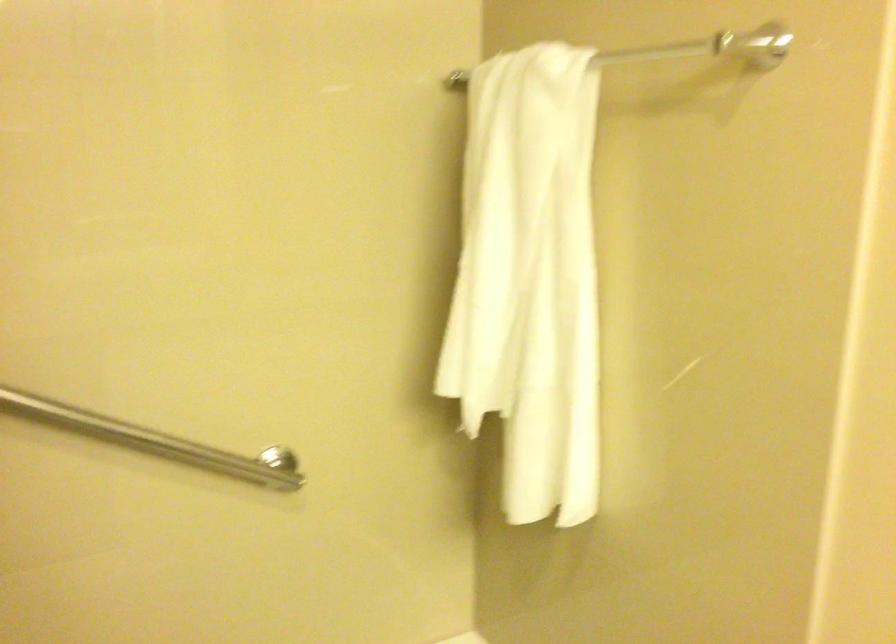
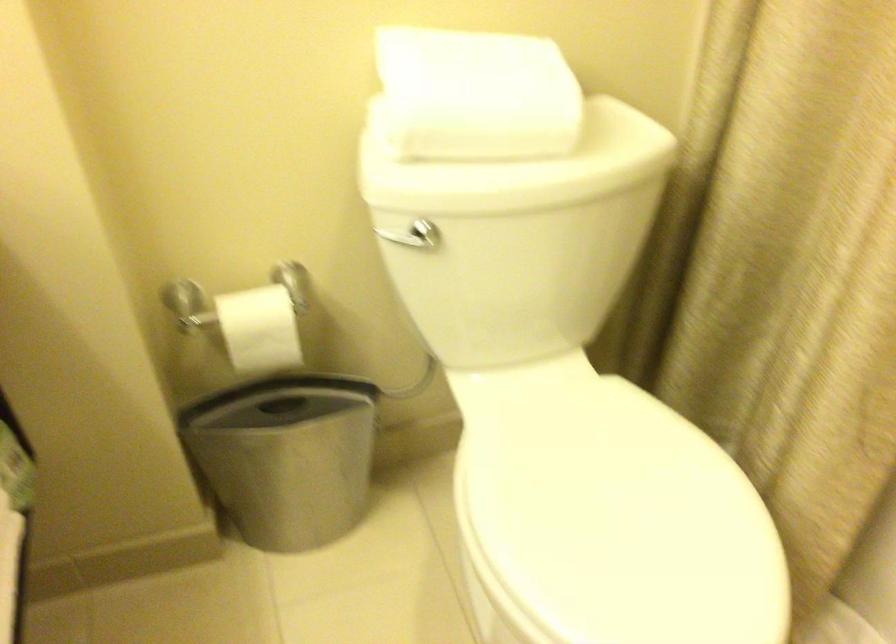
The images are taken continuously from a first-person perspective. In which direction is your viewpoint rotating?

The camera rotated toward left-down.